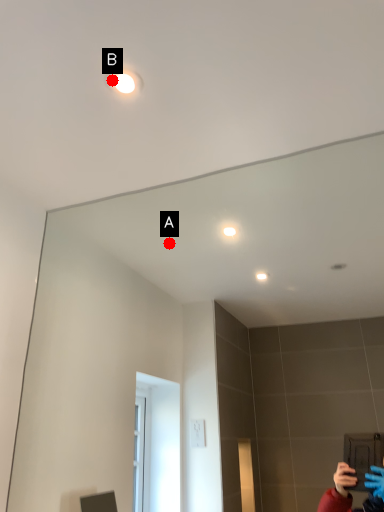
Question: Two points are circled on the image, labeled by A and B beside each circle. Which of the following is the closest to the observer?

Choices:
 (A) A is closer
 (B) B is closer

Answer: (B)